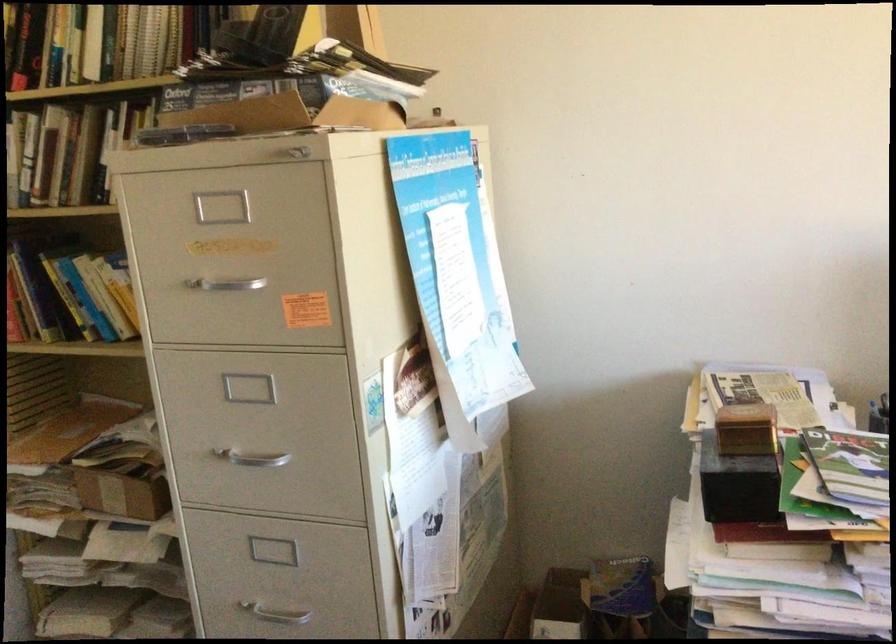
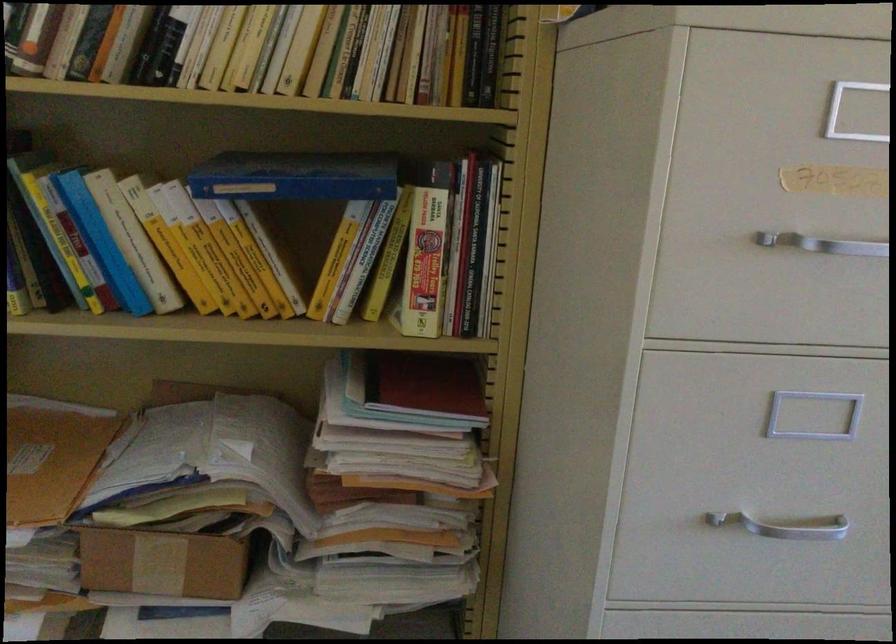
In the second image, find the point that corresponds to (212,283) in the first image.

(823, 243)